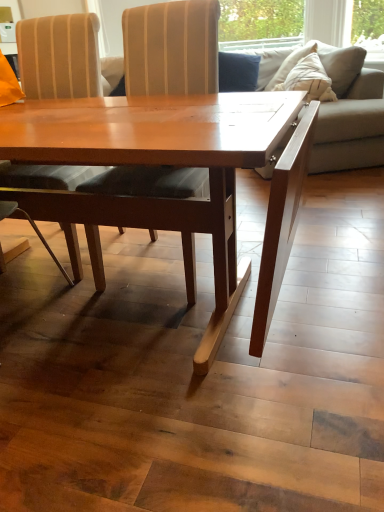
Question: Is velvet blue pillow at upper center wider or thinner than wooden striped chair at center, arranged as the 1th chair when viewed from the right?

Choices:
 (A) thin
 (B) wide

Answer: (A)

Question: Based on their positions, is velvet blue pillow at upper center located to the left or right of wooden striped chair at center, arranged as the 1th chair when viewed from the right?

Choices:
 (A) left
 (B) right

Answer: (B)

Question: Estimate the real-world distances between objects in this image. Which object is farther from the beige fabric couch at right?

Choices:
 (A) matte wood chair at center, which appears as the first chair when viewed from the left
 (B) wooden striped chair at center, which appears as the 2th chair when viewed from the left
 (C) velvet blue pillow at upper center

Answer: (A)

Question: Estimate the real-world distances between objects in this image. Which object is farther from the wooden striped chair at center, arranged as the 1th chair when viewed from the right?

Choices:
 (A) matte wood chair at center, which appears as the first chair when viewed from the left
 (B) beige fabric couch at right
 (C) velvet blue pillow at upper center

Answer: (C)